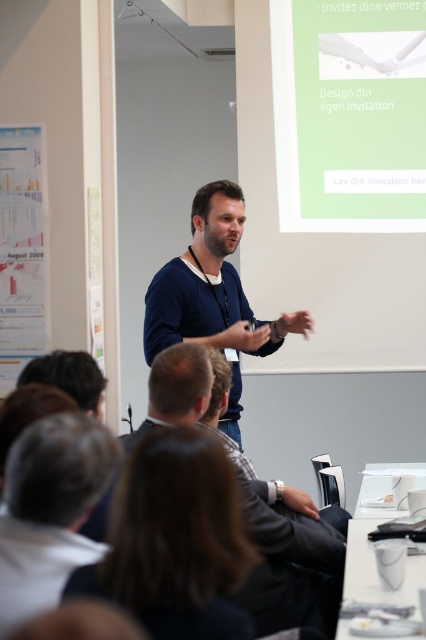
Looking at this image, you are standing at the point labeled point (19, 448) in a professional setting where a presentation is taking place. You want to take a photo of the presenter using a camera that has a minimum focusing distance of 1.5 meters. Can you take a clear photo of the presenter from your current position?

The distance between point (19, 448) and the camera is 1.71 meters, which is greater than the camera minimum focusing distance of 1.5 meters. Therefore, you can take a clear photo of the presenter from your current position.

You are a photographer at the event and need to capture a clear shot of both the white fabric shirt at lower left and the dark blue sweater at center. Which clothing item will appear taller in the photo?

The dark blue sweater at center will appear taller in the photo because the white fabric shirt at lower left is not as tall as the dark blue sweater at center.

What is located at the point with coordinates (175,540) in the image?

The point at coordinates (175,540) corresponds to the dark brown hair at upper center.